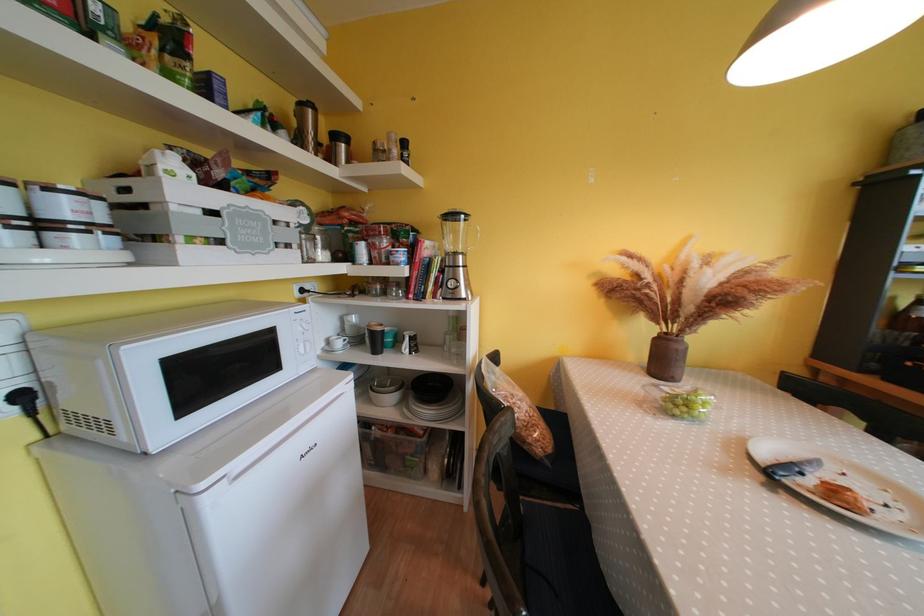
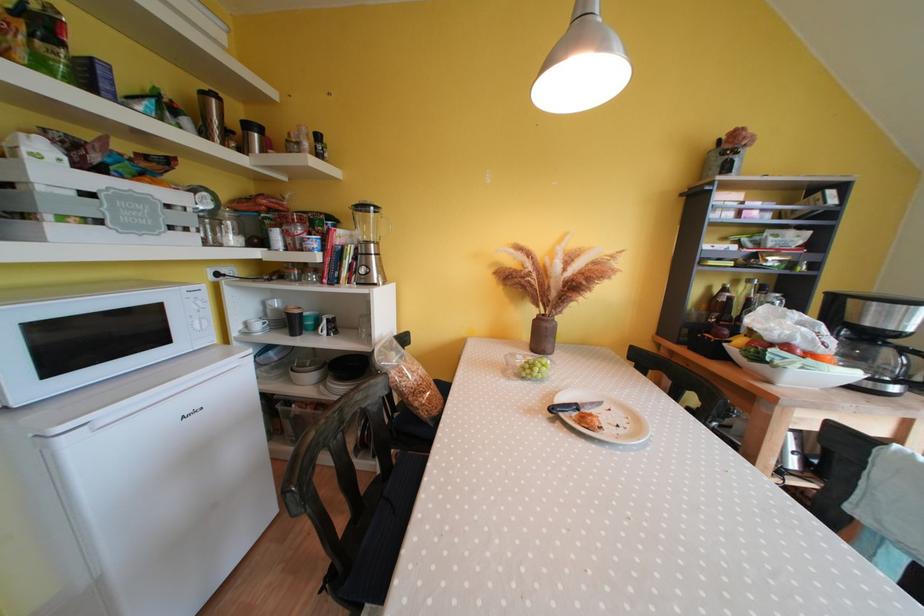
Where in the second image is the point corresponding to the point at 444,282 from the first image?

(357, 269)